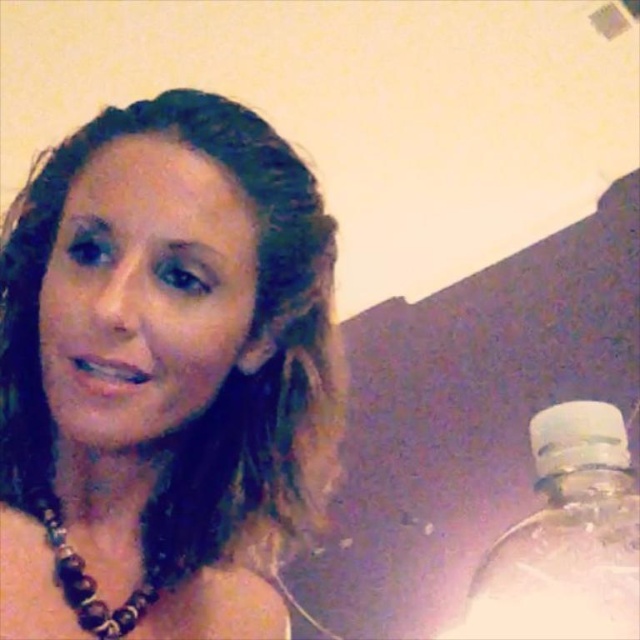
Which of these two, brown beaded necklace at center or brown beaded necklace at lower left, stands taller?

Standing taller between the two is brown beaded necklace at center.

Between point (17, 435) and point (51, 508), which one is positioned in front?

Point (51, 508)

Identify the location of brown beaded necklace at center. (163, 374).

Between clear plastic bottle at lower right and brown beaded necklace at lower left, which one is positioned higher?

brown beaded necklace at lower left is above.

Between clear plastic bottle at lower right and brown beaded necklace at lower left, which one has less height?

brown beaded necklace at lower left

This screenshot has width=640, height=640. I want to click on clear plastic bottle at lower right, so click(566, 536).

I want to click on clear plastic bottle at lower right, so click(566, 536).

Is brown beaded necklace at center wider than clear plastic bottle at lower right?

In fact, brown beaded necklace at center might be narrower than clear plastic bottle at lower right.

Is brown beaded necklace at center positioned in front of clear plastic bottle at lower right?

Yes, it is in front of clear plastic bottle at lower right.

You are a GUI agent. You are given a task and a screenshot of the screen. Output one action in this format:
    pyautogui.click(x=<x>, y=<y>)
    Task: Click on the brown beaded necklace at center
    This screenshot has width=640, height=640.
    Given the screenshot: What is the action you would take?
    pyautogui.click(x=163, y=374)